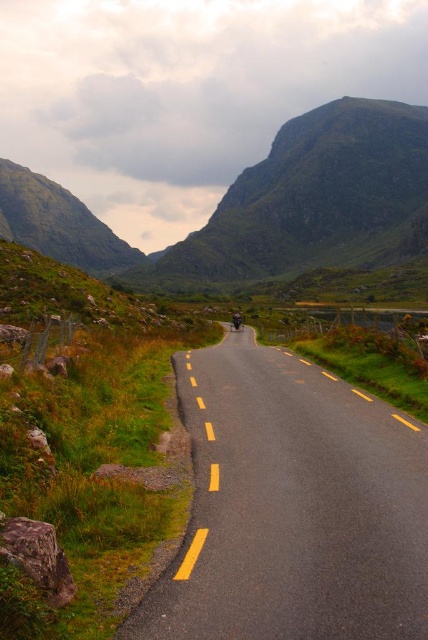
Question: Which object appears closest to the camera in this image?

Choices:
 (A) asphalt road at center
 (B) shiny silver motorcycle at center

Answer: (A)

Question: Which point is farther from the camera taking this photo?

Choices:
 (A) (232, 314)
 (B) (91, 266)

Answer: (B)

Question: Which point is closer to the camera?

Choices:
 (A) green grassy mountain at upper center
 (B) shiny silver motorcycle at center
 (C) asphalt road at center

Answer: (C)

Question: Does asphalt road at center lie behind shiny silver motorcycle at center?

Choices:
 (A) yes
 (B) no

Answer: (B)

Question: Can you confirm if green grassy mountain at upper center is bigger than shiny silver motorcycle at center?

Choices:
 (A) no
 (B) yes

Answer: (B)

Question: Is asphalt road at center above green grassy mountain at upper center?

Choices:
 (A) yes
 (B) no

Answer: (B)